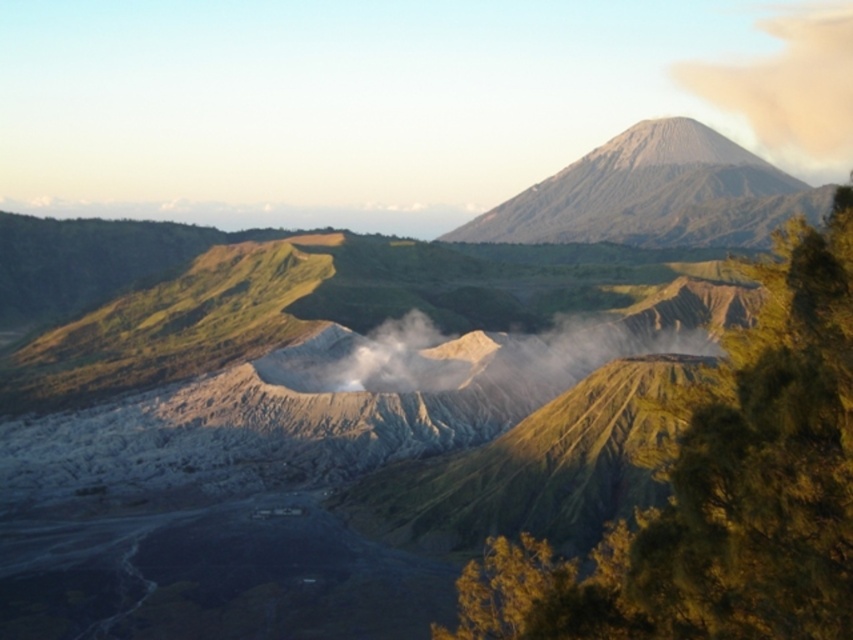
You are a photographer planning to capture the sunrise over the volcanic landscape. You notice a green leafy tree at upper right and a white dusty cloud at upper right. Which of these two objects would appear smaller in your photo?

The green leafy tree at upper right would appear smaller in the photo because its width is less than the white dusty cloud at upper right.

You are a hiker trying to navigate through the volcanic landscape. You see the white smoke at center and the white dusty cloud at upper right. Which of these two objects is closer to you?

The white smoke at center is closer to you because it is positioned in front of the white dusty cloud at upper right.